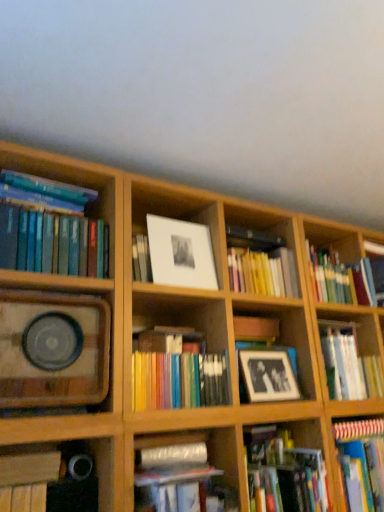
Question: Can you confirm if black matte book at lower left, the 3th book positioned from the left, is thinner than yellow matte book at center, which is counted as the 3th book, starting from the right?

Choices:
 (A) no
 (B) yes

Answer: (B)

Question: Is black matte book at lower left, which is counted as the sixth book, starting from the right, smaller than yellow matte book at center, which is counted as the 6th book, starting from the left?

Choices:
 (A) no
 (B) yes

Answer: (B)

Question: Considering the relative sizes of black matte book at lower left, which is counted as the sixth book, starting from the right, and yellow matte book at center, which is counted as the 3th book, starting from the right, in the image provided, is black matte book at lower left, which is counted as the sixth book, starting from the right, bigger than yellow matte book at center, which is counted as the 3th book, starting from the right,?

Choices:
 (A) no
 (B) yes

Answer: (A)

Question: From the image's perspective, is black matte book at lower left, the 3th book positioned from the left, over yellow matte book at center, which is counted as the 3th book, starting from the right?

Choices:
 (A) yes
 (B) no

Answer: (B)

Question: From a real-world perspective, is black matte book at lower left, which is counted as the sixth book, starting from the right, physically below yellow matte book at center, which is counted as the 6th book, starting from the left?

Choices:
 (A) yes
 (B) no

Answer: (A)

Question: From the image's perspective, is yellow matte book at center, which is counted as the 6th book, starting from the left, above or below metallic silver tape at lower center, the fourth book positioned from the right?

Choices:
 (A) above
 (B) below

Answer: (A)

Question: Considering the positions of yellow matte book at center, which is counted as the 6th book, starting from the left, and metallic silver tape at lower center, the fourth book positioned from the right, in the image, is yellow matte book at center, which is counted as the 6th book, starting from the left, bigger or smaller than metallic silver tape at lower center, the fourth book positioned from the right,?

Choices:
 (A) small
 (B) big

Answer: (B)

Question: From a real-world perspective, is yellow matte book at center, which is counted as the 3th book, starting from the right, physically located above or below metallic silver tape at lower center, the fifth book positioned from the left?

Choices:
 (A) above
 (B) below

Answer: (A)

Question: Is yellow matte book at center, which is counted as the 3th book, starting from the right, inside the boundaries of metallic silver tape at lower center, the fourth book positioned from the right, or outside?

Choices:
 (A) inside
 (B) outside

Answer: (B)

Question: From their relative heights in the image, would you say yellow matte book at center, which is counted as the 3th book, starting from the right, is taller or shorter than multicolored paperbacks at center, which is the fifth book from right to left?

Choices:
 (A) short
 (B) tall

Answer: (A)

Question: In terms of width, does yellow matte book at center, which is counted as the 6th book, starting from the left, look wider or thinner when compared to multicolored paperbacks at center, which is the fifth book from right to left?

Choices:
 (A) wide
 (B) thin

Answer: (A)

Question: From the image's perspective, is yellow matte book at center, which is counted as the 6th book, starting from the left, located above or below multicolored paperbacks at center, the fourth book viewed from the left?

Choices:
 (A) below
 (B) above

Answer: (B)

Question: Do you think yellow matte book at center, which is counted as the 3th book, starting from the right, is within multicolored paperbacks at center, the fourth book viewed from the left, or outside of it?

Choices:
 (A) inside
 (B) outside

Answer: (B)

Question: From the image's perspective, relative to yellow matte book at center, which is counted as the 6th book, starting from the left, is matte black frame at center, the first shelf positioned from the right, above or below?

Choices:
 (A) above
 (B) below

Answer: (B)

Question: Relative to yellow matte book at center, which is counted as the 3th book, starting from the right, is matte black frame at center, the first shelf positioned from the right, in front or behind?

Choices:
 (A) behind
 (B) front

Answer: (B)